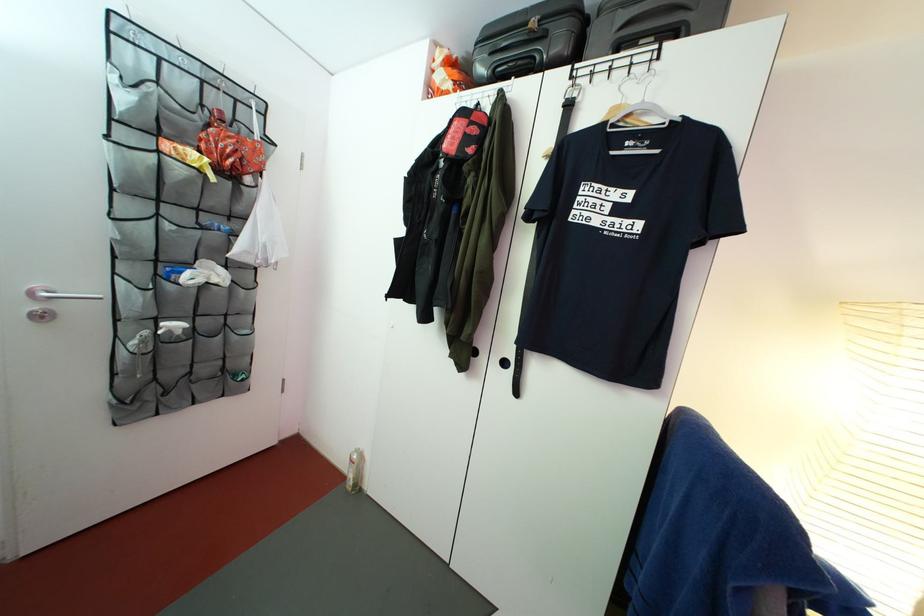
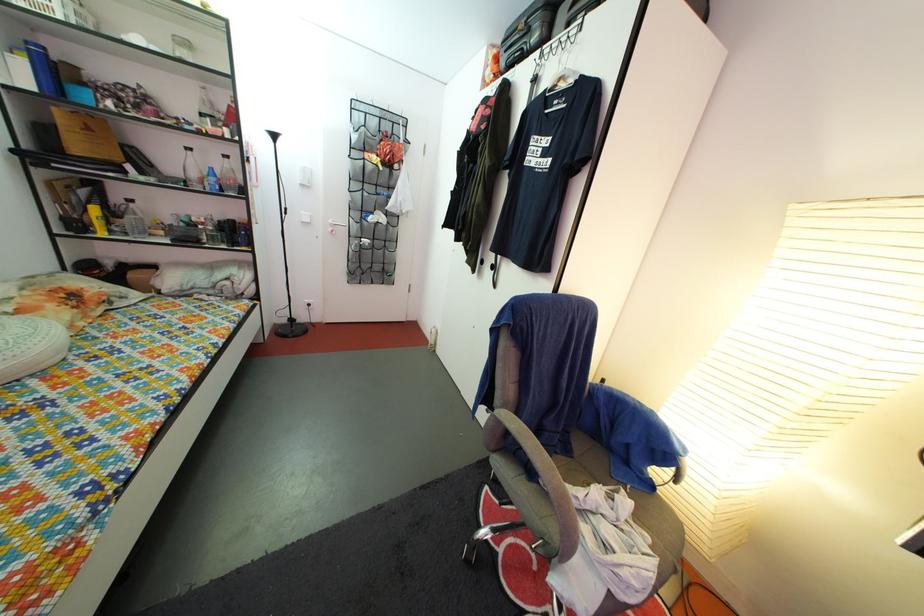
The point at (626, 55) is marked in the first image. Where is the corresponding point in the second image?

(578, 31)